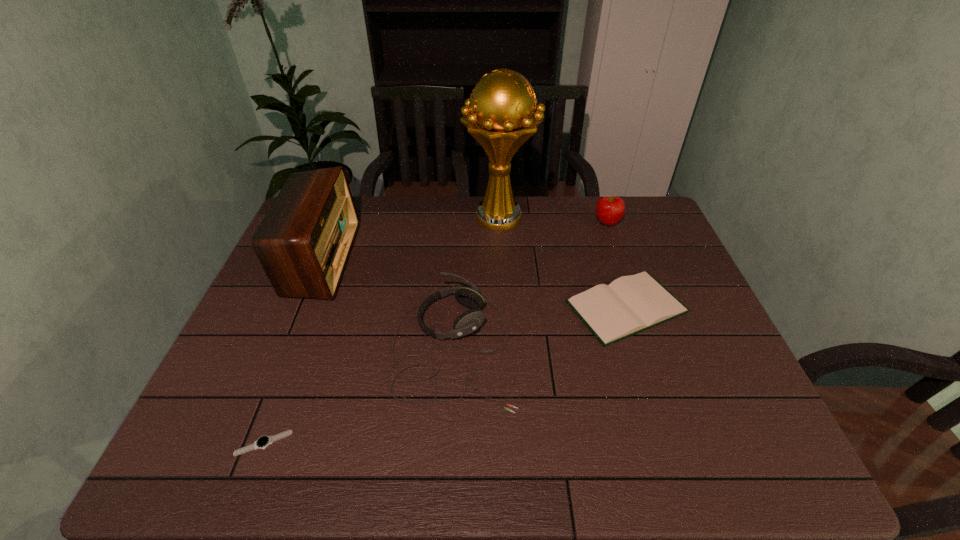
You are a GUI agent. You are given a task and a screenshot of the screen. Output one action in this format:
    pyautogui.click(x=<x>, y=<y>)
    Task: Click on the hardback book present at the right edge
    
    Given the screenshot: What is the action you would take?
    pyautogui.click(x=631, y=304)

Where is `object at the far left corner`? This screenshot has width=960, height=540. object at the far left corner is located at coordinates (303, 243).

The width and height of the screenshot is (960, 540). In order to click on object that is at the near left corner in this screenshot , I will do point(263,442).

I want to click on object positioned at the far right corner, so click(609, 210).

You are a GUI agent. You are given a task and a screenshot of the screen. Output one action in this format:
    pyautogui.click(x=<x>, y=<y>)
    Task: Click on the free spot at the far edge of the desktop
    This screenshot has width=960, height=540.
    Given the screenshot: What is the action you would take?
    pyautogui.click(x=564, y=197)

Identify the location of free space at the near edge of the desktop. Image resolution: width=960 pixels, height=540 pixels. (403, 440).

Locate an element on the screen. This screenshot has width=960, height=540. free space at the left edge of the desktop is located at coordinates (299, 327).

Identify the location of free space at the right edge. Image resolution: width=960 pixels, height=540 pixels. (716, 414).

Identify the location of free space between the radio receiver and the nearest object. (293, 351).

At what (x,y) coordinates should I click in order to perform the action: click on vacant area between the tallest object and the radio receiver. Please return your answer as a coordinate pair (x, y). The height and width of the screenshot is (540, 960). Looking at the image, I should click on (410, 239).